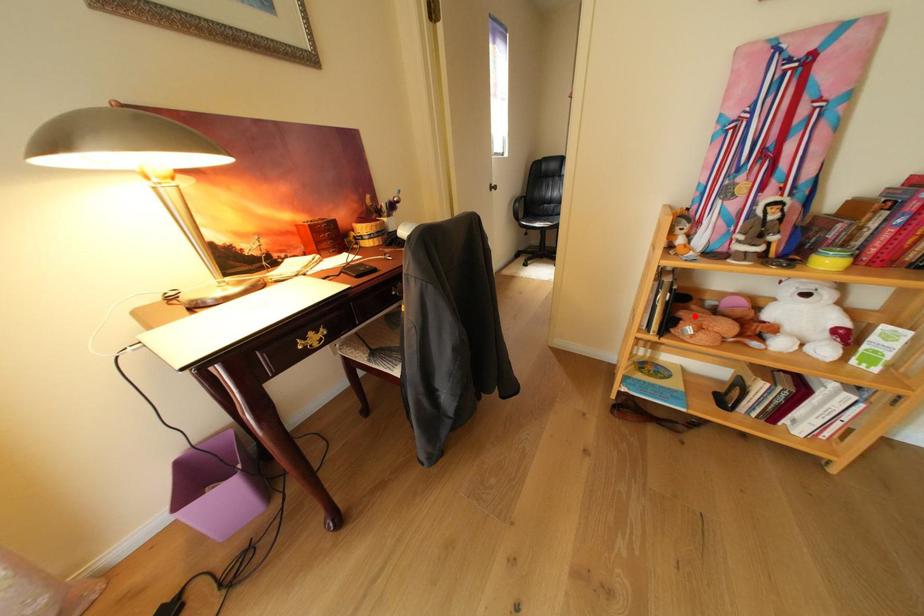
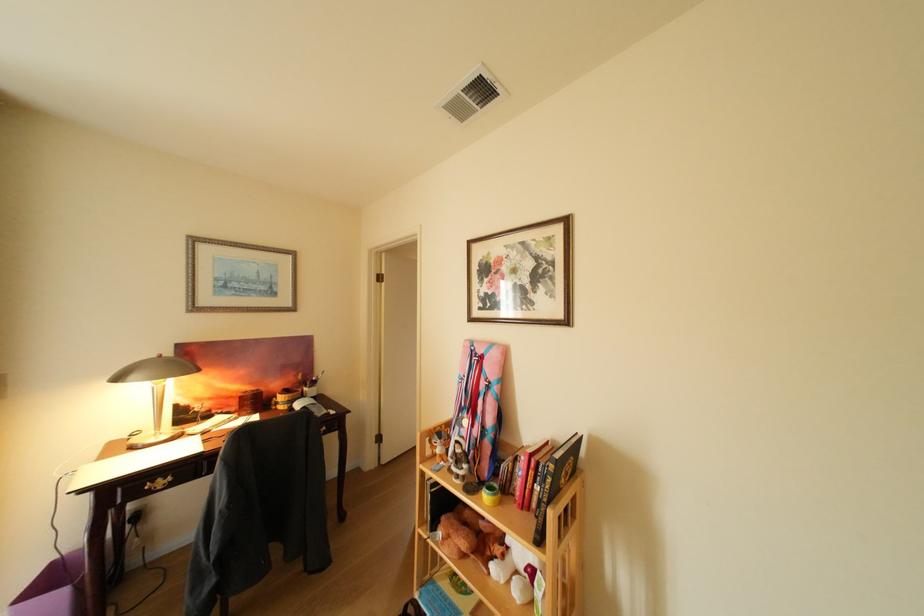
Question: I am providing you with two images of the same scene from different viewpoints. Image1 has a red point marked. In image2, the corresponding 3D location appears at what relative position? Reply with the corresponding letter.

Choices:
 (A) Closer
 (B) Farther

Answer: (B)